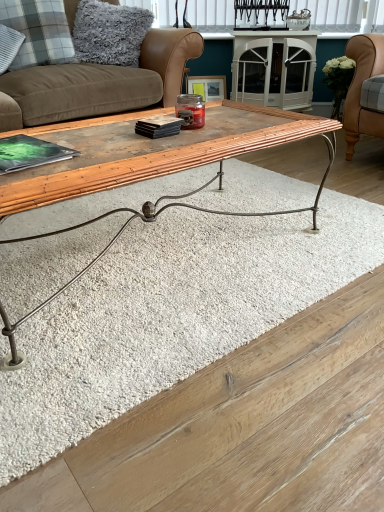
Question: Should I look upward or downward to see white blinds at upper center?

Choices:
 (A) down
 (B) up

Answer: (B)

Question: Is white blinds at upper center aimed at brown suede studio couch at upper left?

Choices:
 (A) no
 (B) yes

Answer: (A)

Question: Is white blinds at upper center bigger than brown suede studio couch at upper left?

Choices:
 (A) yes
 (B) no

Answer: (B)

Question: Is white blinds at upper center further to camera compared to brown suede studio couch at upper left?

Choices:
 (A) yes
 (B) no

Answer: (A)

Question: Is the surface of white blinds at upper center in direct contact with brown suede studio couch at upper left?

Choices:
 (A) no
 (B) yes

Answer: (A)

Question: From a real-world perspective, does white blinds at upper center sit lower than brown suede studio couch at upper left?

Choices:
 (A) yes
 (B) no

Answer: (B)

Question: Is white blinds at upper center smaller than brown suede studio couch at upper left?

Choices:
 (A) yes
 (B) no

Answer: (A)

Question: Considering the relative sizes of plaid fabric pillow at upper left, the second pillow positioned from the right, and gray fluffy pillow at upper left, the 2th pillow viewed from the left, in the image provided, is plaid fabric pillow at upper left, the second pillow positioned from the right, shorter than gray fluffy pillow at upper left, the 2th pillow viewed from the left,?

Choices:
 (A) yes
 (B) no

Answer: (A)

Question: Can you confirm if plaid fabric pillow at upper left, which is counted as the 1th pillow, starting from the left, is positioned to the right of gray fluffy pillow at upper left, the 2th pillow viewed from the left?

Choices:
 (A) no
 (B) yes

Answer: (A)

Question: From a real-world perspective, is plaid fabric pillow at upper left, the second pillow positioned from the right, over gray fluffy pillow at upper left, which ranks as the first pillow in right-to-left order?

Choices:
 (A) no
 (B) yes

Answer: (A)

Question: Is gray fluffy pillow at upper left, which ranks as the first pillow in right-to-left order, at the back of plaid fabric pillow at upper left, which is counted as the 1th pillow, starting from the left?

Choices:
 (A) yes
 (B) no

Answer: (B)

Question: Is plaid fabric pillow at upper left, which is counted as the 1th pillow, starting from the left, outside gray fluffy pillow at upper left, which ranks as the first pillow in right-to-left order?

Choices:
 (A) yes
 (B) no

Answer: (A)

Question: Is plaid fabric pillow at upper left, which is counted as the 1th pillow, starting from the left, wider than gray fluffy pillow at upper left, the 2th pillow viewed from the left?

Choices:
 (A) no
 (B) yes

Answer: (B)

Question: Is the position of plaid fabric pillow at upper left, the second pillow positioned from the right, less distant than that of white blinds at upper center?

Choices:
 (A) yes
 (B) no

Answer: (A)